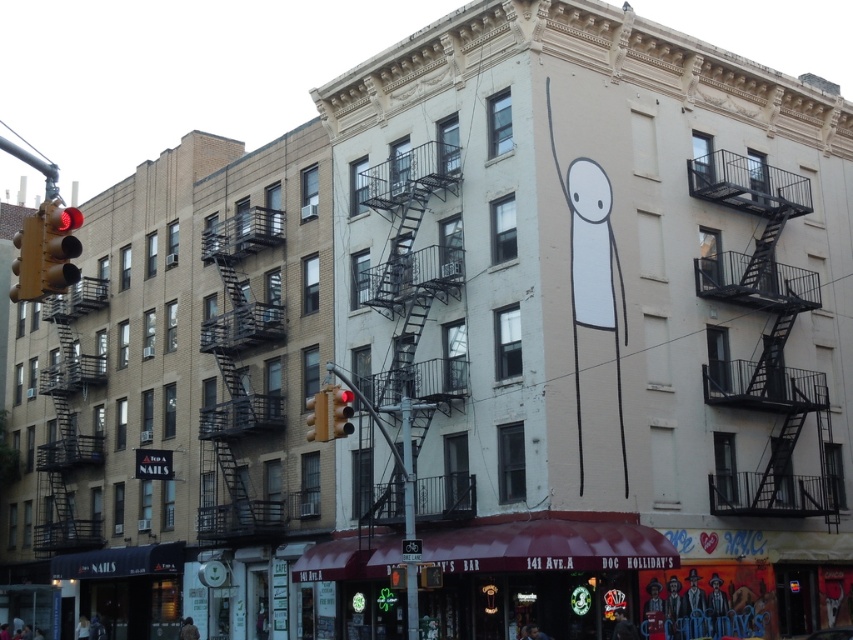
What do you see at coordinates (317, 417) in the screenshot? This screenshot has height=640, width=853. I see `metallic yellow traffic light at center` at bounding box center [317, 417].

Is point (318, 406) closer to camera compared to point (343, 419)?

No, (318, 406) is further to viewer.

Identify the location of metallic yellow traffic light at center. (317, 417).

Can you confirm if metallic pole at center is bigger than red glass traffic light at center?

Indeed, metallic pole at center has a larger size compared to red glass traffic light at center.

Who is positioned more to the right, metallic pole at center or red glass traffic light at center?

From the viewer's perspective, metallic pole at center appears more on the right side.

Does point (402, 419) lie behind point (334, 406)?

Yes, point (402, 419) is farther from viewer.

Image resolution: width=853 pixels, height=640 pixels. Identify the location of metallic pole at center. (407, 467).

Does point (730, 182) come farther from viewer compared to point (320, 413)?

That is True.

Between point (770, 308) and point (318, 410), which one is positioned behind?

The point (770, 308) is more distant.

You are a GUI agent. You are given a task and a screenshot of the screen. Output one action in this format:
    pyautogui.click(x=<x>, y=<y>)
    Task: Click on the black metal fire escape at right
    The width and height of the screenshot is (853, 640).
    Given the screenshot: What is the action you would take?
    pyautogui.click(x=764, y=340)